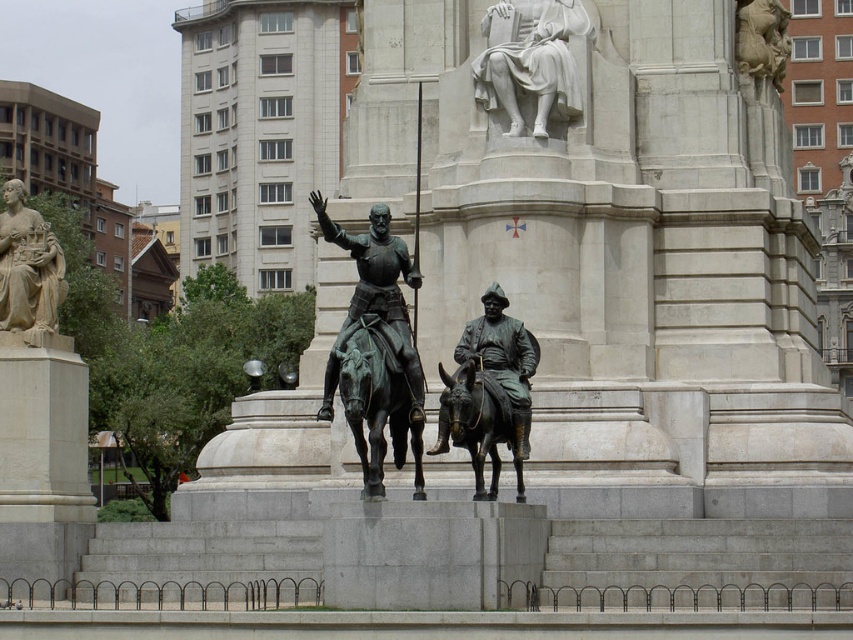
Question: Which point is farther to the camera?

Choices:
 (A) green patina statue at center
 (B) bronze/golden horse at center
 (C) bronze statue at center
 (D) bronze/dark brown horse at center

Answer: (C)

Question: Does bronze/golden horse at center appear on the left side of polished marble horse at upper right?

Choices:
 (A) yes
 (B) no

Answer: (A)

Question: Considering the real-world distances, which object is closest to the bronze statue at center?

Choices:
 (A) green patina statue at center
 (B) polished bronze statue at left
 (C) polished marble horse at upper right
 (D) white marble statue at upper center

Answer: (A)

Question: Is the position of green patina statue at center more distant than that of bronze statue at center?

Choices:
 (A) yes
 (B) no

Answer: (B)

Question: In this image, where is bronze/golden horse at center located relative to bronze statue at center?

Choices:
 (A) left
 (B) right

Answer: (A)

Question: Among these objects, which one is farthest from the camera?

Choices:
 (A) polished marble horse at upper right
 (B) bronze/dark brown horse at center
 (C) white marble statue at upper center

Answer: (A)